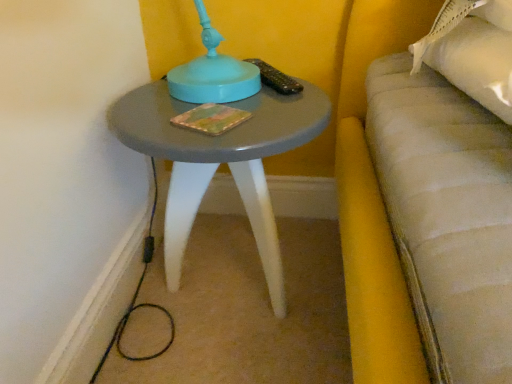
Question: Is multicolored textured book at center at the back of matte gray table at center?

Choices:
 (A) yes
 (B) no

Answer: (B)

Question: Is matte gray table at center oriented towards multicolored textured book at center?

Choices:
 (A) yes
 (B) no

Answer: (B)

Question: Does matte gray table at center have a greater width compared to multicolored textured book at center?

Choices:
 (A) yes
 (B) no

Answer: (A)

Question: Is matte gray table at center outside multicolored textured book at center?

Choices:
 (A) no
 (B) yes

Answer: (B)

Question: Can you confirm if matte gray table at center is shorter than multicolored textured book at center?

Choices:
 (A) yes
 (B) no

Answer: (B)

Question: Considering the relative sizes of matte gray table at center and multicolored textured book at center in the image provided, is matte gray table at center bigger than multicolored textured book at center?

Choices:
 (A) yes
 (B) no

Answer: (A)

Question: From a real-world perspective, is multicolored textured book at center positioned under matte gray table at center based on gravity?

Choices:
 (A) yes
 (B) no

Answer: (B)

Question: Does multicolored textured book at center turn towards matte gray table at center?

Choices:
 (A) no
 (B) yes

Answer: (B)

Question: Is multicolored textured book at center further to the viewer compared to matte gray table at center?

Choices:
 (A) no
 (B) yes

Answer: (B)

Question: Can we say multicolored textured book at center lies outside matte gray table at center?

Choices:
 (A) no
 (B) yes

Answer: (A)

Question: From a real-world perspective, is multicolored textured book at center on top of matte gray table at center?

Choices:
 (A) yes
 (B) no

Answer: (A)

Question: Considering the relative sizes of multicolored textured book at center and matte gray table at center in the image provided, is multicolored textured book at center shorter than matte gray table at center?

Choices:
 (A) yes
 (B) no

Answer: (A)

Question: Is matte gray table at center taller or shorter than multicolored textured book at center?

Choices:
 (A) tall
 (B) short

Answer: (A)